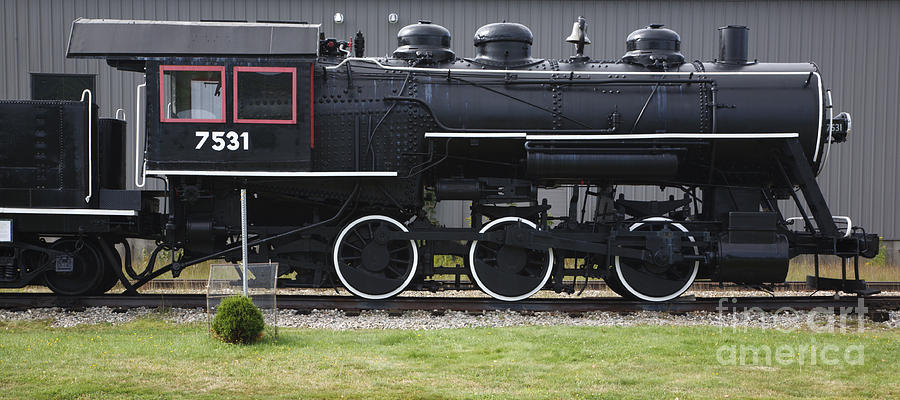
This screenshot has width=900, height=400. What are the coordinates of `handle` in the screenshot? It's located at (96, 148), (126, 102), (131, 127).